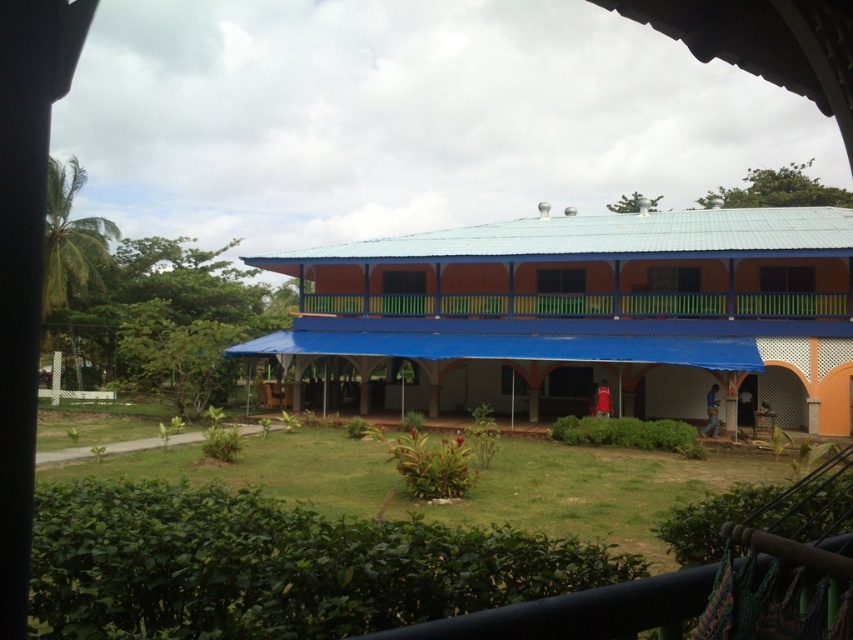
Which of these two, blue fabric canopy at center or green painted wood balcony at center, stands shorter?

green painted wood balcony at center is shorter.

Describe the element at coordinates (585, 304) in the screenshot. This screenshot has height=640, width=853. I see `blue fabric canopy at center` at that location.

Which is in front, point (747, 237) or point (721, 300)?

Point (721, 300) is more forward.

Find the location of a particular element. The width and height of the screenshot is (853, 640). blue fabric canopy at center is located at coordinates (585, 304).